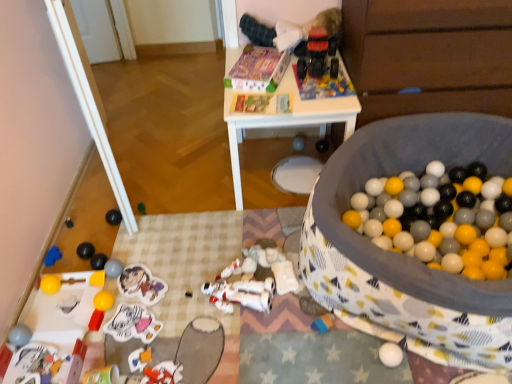
You are a GUI agent. You are given a task and a screenshot of the screen. Output one action in this format:
    pyautogui.click(x=<x>, y=<y>)
    Task: Click on the free point to the right of matte gray ball at lower left, which is counted as the tenth toy, starting from the left
    The image size is (512, 384).
    Given the screenshot: What is the action you would take?
    coord(156,274)